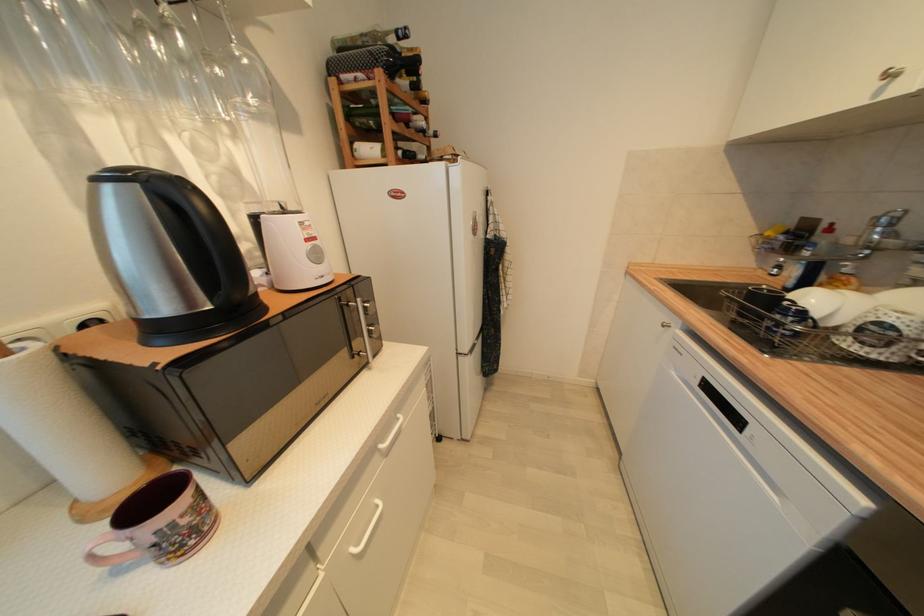
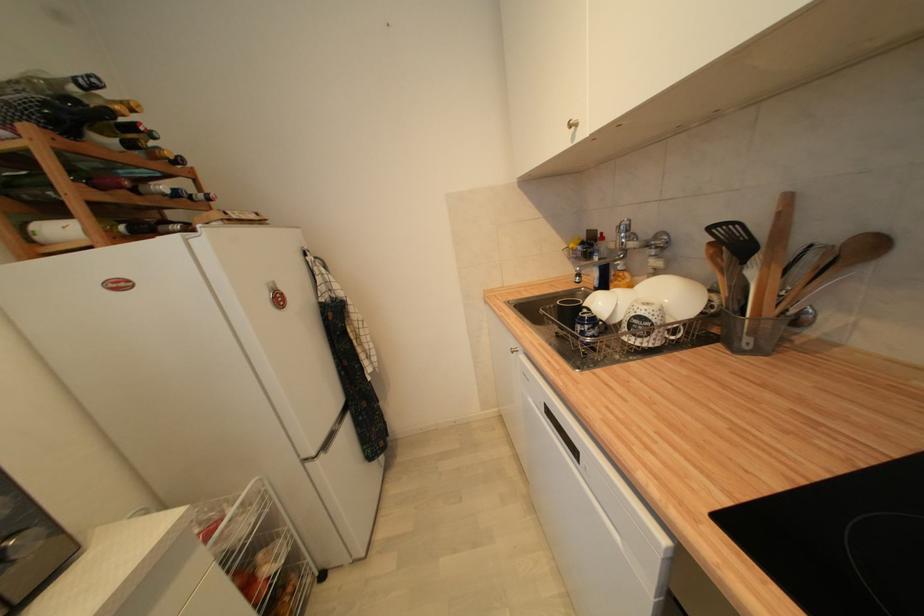
In the second image, find the point that corresponds to point 896,227 in the first image.

(633, 233)